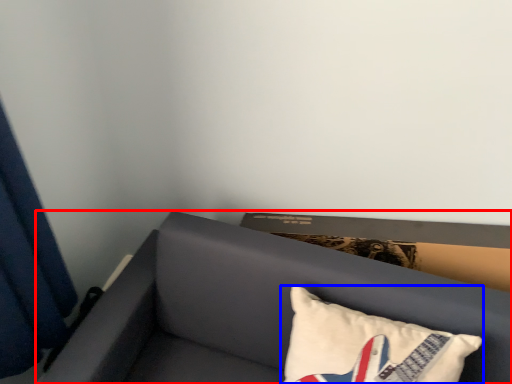
Question: Which of the following is the farthest to the observer, furniture (highlighted by a red box) or pillow (highlighted by a blue box)?

Choices:
 (A) furniture
 (B) pillow

Answer: (B)